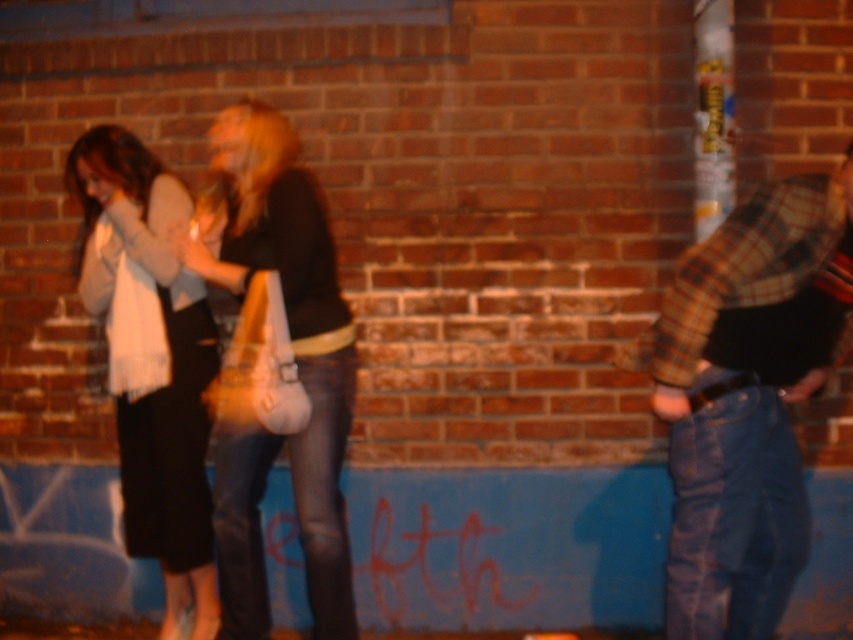
Can you confirm if matte white bag at center is smaller than white scarf at left?

Yes, matte white bag at center is smaller than white scarf at left.

Is matte white bag at center closer to the viewer compared to white scarf at left?

Yes, it is.

Is point (215, 161) positioned after point (195, 502)?

Yes, it is behind point (195, 502).

This screenshot has height=640, width=853. I want to click on matte white bag at center, so click(296, 368).

Who is shorter, plaid flannel shirt at right or matte white bag at center?

Standing shorter between the two is plaid flannel shirt at right.

Can you confirm if plaid flannel shirt at right is smaller than matte white bag at center?

Actually, plaid flannel shirt at right might be larger than matte white bag at center.

Is point (711, 301) positioned before point (294, 218)?

Yes, it is.

Where is `plaid flannel shirt at right`? plaid flannel shirt at right is located at coordinates (747, 397).

Can you confirm if plaid flannel shirt at right is bigger than white scarf at left?

Yes.

Who is positioned more to the right, plaid flannel shirt at right or white scarf at left?

plaid flannel shirt at right

Is point (785, 262) closer to camera compared to point (126, 426)?

That is True.

In order to click on plaid flannel shirt at right in this screenshot , I will do `click(747, 397)`.